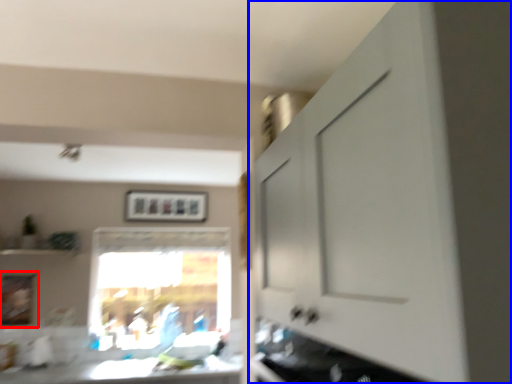
Question: Which of the following is the closest to the observer, picture frame (highlighted by a red box) or cabinetry (highlighted by a blue box)?

Choices:
 (A) picture frame
 (B) cabinetry

Answer: (B)